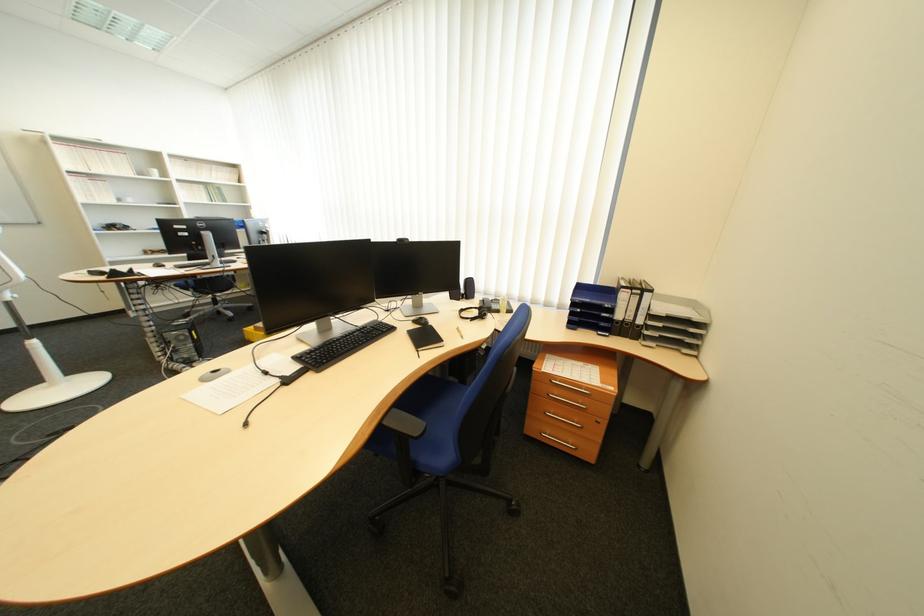
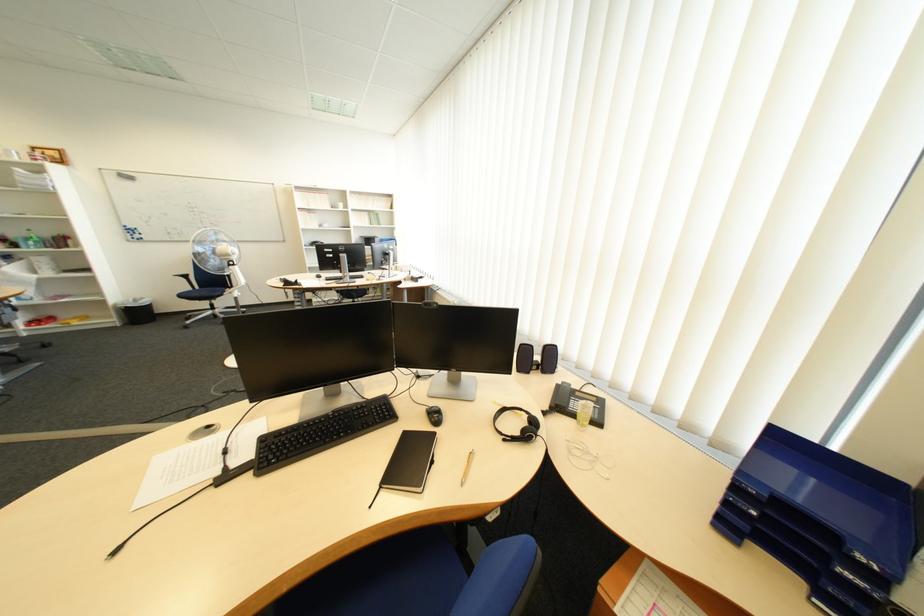
The point at (591, 312) is marked in the first image. Where is the corresponding point in the second image?

(767, 514)